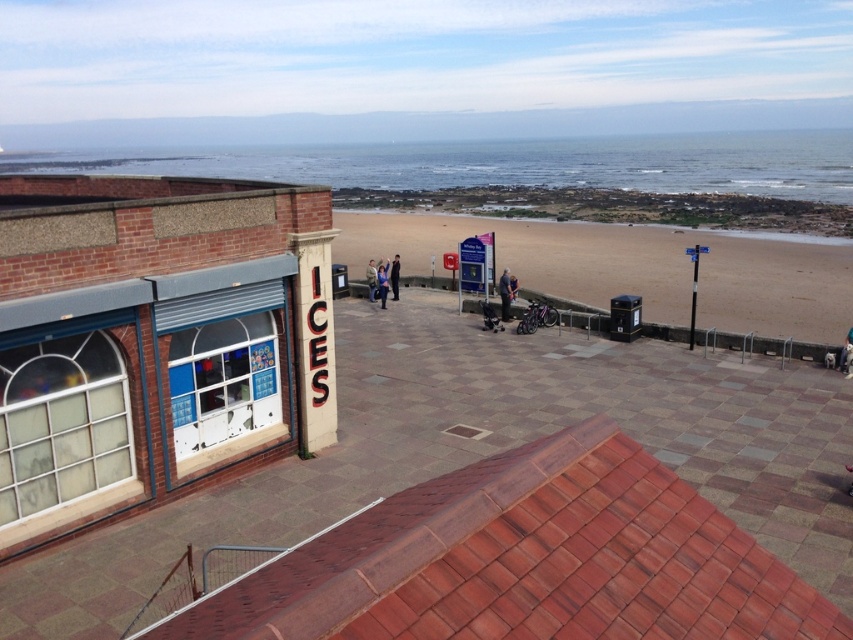
Question: Which of the following is the closest to the observer?

Choices:
 (A) blue denim jeans at center
 (B) brown sand at center
 (C) blue water at upper center
 (D) dark blue jeans at center

Answer: (B)

Question: Does dark blue jeans at center have a lesser width compared to light blue denim jacket at center?

Choices:
 (A) no
 (B) yes

Answer: (B)

Question: Can you confirm if blue denim jeans at center is positioned to the left of light blue denim jacket at center?

Choices:
 (A) yes
 (B) no

Answer: (B)

Question: Which point appears closest to the camera in this image?

Choices:
 (A) (367, 268)
 (B) (650, 230)
 (C) (505, 308)

Answer: (C)

Question: Which of the following is the closest to the observer?

Choices:
 (A) (691, 186)
 (B) (508, 317)

Answer: (B)

Question: Does blue water at upper center have a lesser width compared to blue denim jacket at center?

Choices:
 (A) yes
 (B) no

Answer: (B)